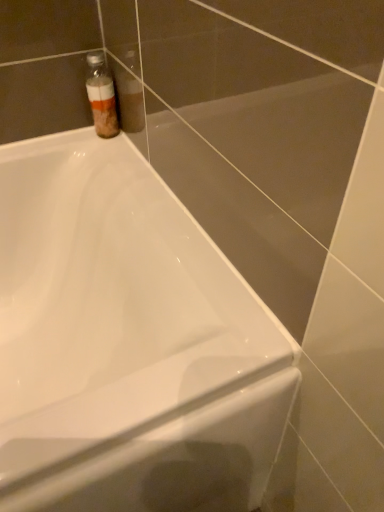
Question: Considering the relative sizes of translucent plastic bottle at upper left and white glossy bathtub at upper left in the image provided, is translucent plastic bottle at upper left smaller than white glossy bathtub at upper left?

Choices:
 (A) yes
 (B) no

Answer: (A)

Question: From the image's perspective, is translucent plastic bottle at upper left on top of white glossy bathtub at upper left?

Choices:
 (A) no
 (B) yes

Answer: (B)

Question: From a real-world perspective, is translucent plastic bottle at upper left physically below white glossy bathtub at upper left?

Choices:
 (A) yes
 (B) no

Answer: (B)

Question: Is translucent plastic bottle at upper left turned away from white glossy bathtub at upper left?

Choices:
 (A) no
 (B) yes

Answer: (A)

Question: Would you consider translucent plastic bottle at upper left to be distant from white glossy bathtub at upper left?

Choices:
 (A) yes
 (B) no

Answer: (B)

Question: Considering the relative positions of translucent plastic bottle at upper left and white glossy bathtub at upper left in the image provided, is translucent plastic bottle at upper left in front of white glossy bathtub at upper left?

Choices:
 (A) yes
 (B) no

Answer: (B)

Question: Considering the relative sizes of white glossy bathtub at upper left and translucent plastic bottle at upper left in the image provided, is white glossy bathtub at upper left smaller than translucent plastic bottle at upper left?

Choices:
 (A) no
 (B) yes

Answer: (A)

Question: Is white glossy bathtub at upper left far from translucent plastic bottle at upper left?

Choices:
 (A) yes
 (B) no

Answer: (B)

Question: Is white glossy bathtub at upper left facing away from translucent plastic bottle at upper left?

Choices:
 (A) no
 (B) yes

Answer: (A)

Question: Considering the relative sizes of white glossy bathtub at upper left and translucent plastic bottle at upper left in the image provided, is white glossy bathtub at upper left wider than translucent plastic bottle at upper left?

Choices:
 (A) yes
 (B) no

Answer: (A)

Question: Can you confirm if white glossy bathtub at upper left is bigger than translucent plastic bottle at upper left?

Choices:
 (A) yes
 (B) no

Answer: (A)

Question: Does white glossy bathtub at upper left lie behind translucent plastic bottle at upper left?

Choices:
 (A) no
 (B) yes

Answer: (A)

Question: Considering the positions of translucent plastic bottle at upper left and white glossy bathtub at upper left in the image, is translucent plastic bottle at upper left bigger or smaller than white glossy bathtub at upper left?

Choices:
 (A) big
 (B) small

Answer: (B)